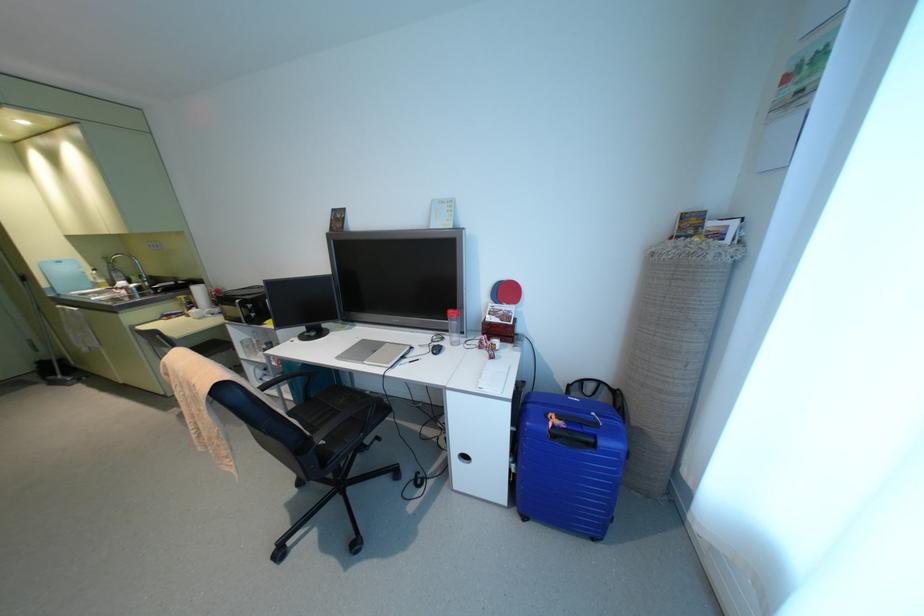
This screenshot has width=924, height=616. What do you see at coordinates (141, 278) in the screenshot?
I see `the metal sink faucet` at bounding box center [141, 278].